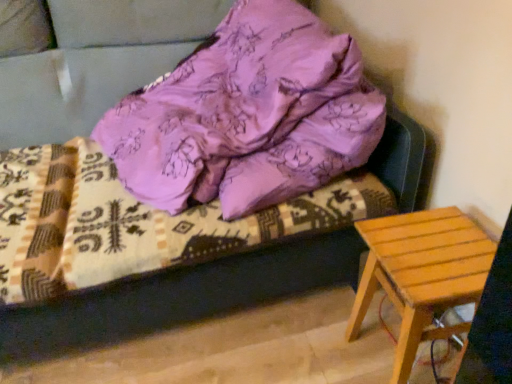
Question: From a real-world perspective, is purple satin bedding at upper center physically located above or below light brown wooden stool at lower right?

Choices:
 (A) below
 (B) above

Answer: (B)

Question: Considering their positions, is purple satin bedding at upper center located in front of or behind light brown wooden stool at lower right?

Choices:
 (A) front
 (B) behind

Answer: (B)

Question: Considering the real-world distances, which object is closest to the purple satin bedding at upper center?

Choices:
 (A) light brown wooden stool at lower right
 (B) purple satin pillow at upper center

Answer: (B)

Question: Based on their relative distances, which object is farther from the light brown wooden stool at lower right?

Choices:
 (A) purple satin bedding at upper center
 (B) purple satin pillow at upper center

Answer: (B)